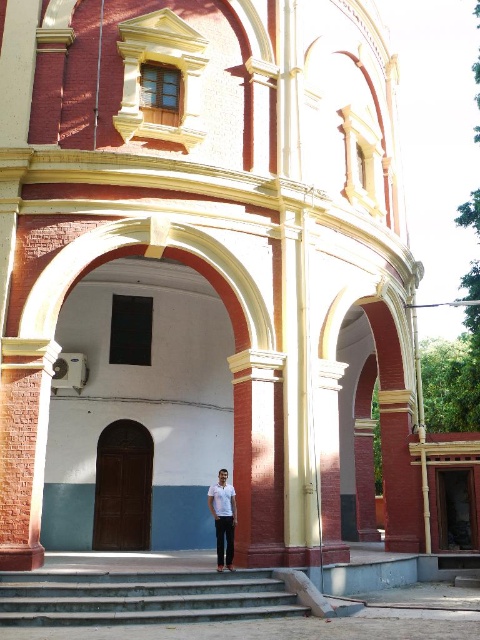
Can you confirm if concrete stairs at center is bigger than white matte shirt at center?

Yes.

Which is in front, point (252, 589) or point (216, 522)?

Point (252, 589) is in front.

Is point (109, 573) farther from viewer compared to point (232, 525)?

No, (109, 573) is in front of (232, 525).

What are the coordinates of `concrete stairs at center` in the screenshot? It's located at (142, 596).